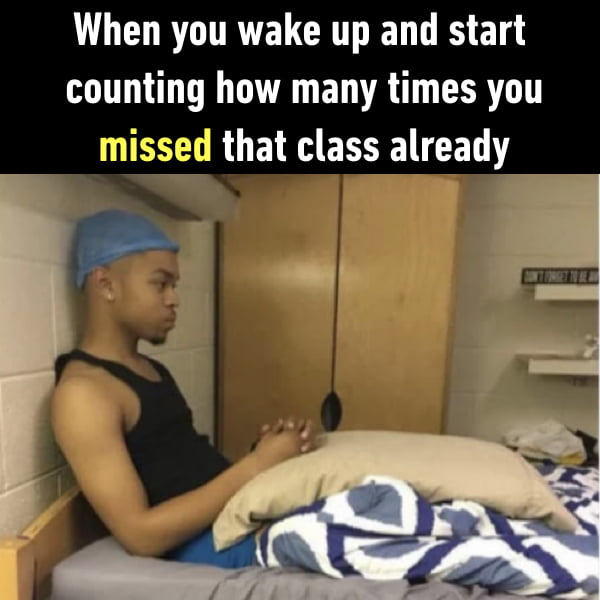
Where is `white shelf`? white shelf is located at coordinates (542, 293), (555, 363).